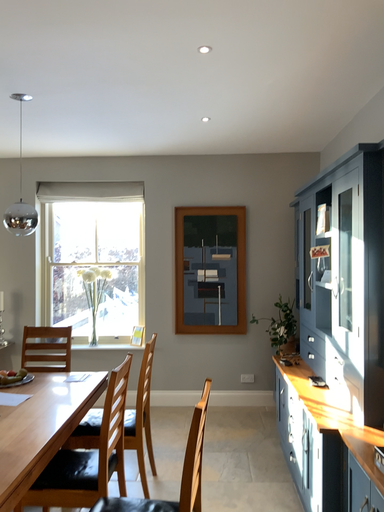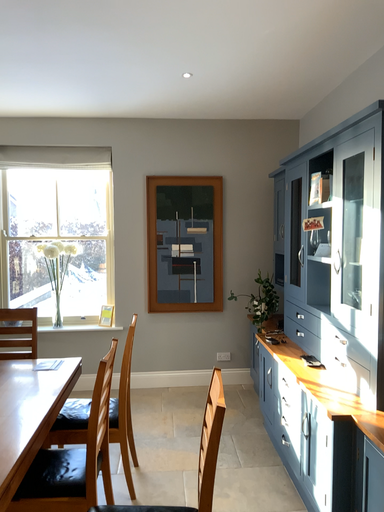
Question: Which way did the camera rotate in the video?

Choices:
 (A) rotated left
 (B) rotated right

Answer: (B)